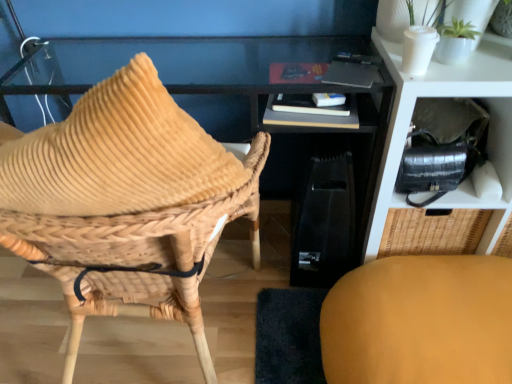
Question: Is matte yellow cushion at lower right, the first chair when ordered from right to left, closer to camera compared to matte black shelf at upper right?

Choices:
 (A) no
 (B) yes

Answer: (B)

Question: Is matte yellow cushion at lower right, positioned as the 2th chair in left-to-right order, taller than matte black shelf at upper right?

Choices:
 (A) yes
 (B) no

Answer: (B)

Question: Can you confirm if matte yellow cushion at lower right, the first chair when ordered from right to left, is smaller than matte black shelf at upper right?

Choices:
 (A) no
 (B) yes

Answer: (B)

Question: Is matte yellow cushion at lower right, the first chair when ordered from right to left, at the right side of matte black shelf at upper right?

Choices:
 (A) no
 (B) yes

Answer: (A)

Question: From the image's perspective, does matte yellow cushion at lower right, the first chair when ordered from right to left, appear higher than matte black shelf at upper right?

Choices:
 (A) no
 (B) yes

Answer: (A)

Question: From a real-world perspective, is matte yellow cushion at lower right, the first chair when ordered from right to left, beneath matte black shelf at upper right?

Choices:
 (A) yes
 (B) no

Answer: (A)

Question: Is hardcover book at center surrounding woven wood chair at left, which is the second chair from right to left?

Choices:
 (A) no
 (B) yes

Answer: (A)

Question: Considering the relative positions of hardcover book at center and woven wood chair at left, which is the second chair from right to left, in the image provided, is hardcover book at center to the right of woven wood chair at left, which is the second chair from right to left, from the viewer's perspective?

Choices:
 (A) no
 (B) yes

Answer: (B)

Question: From a real-world perspective, is hardcover book at center under woven wood chair at left, which is the second chair from right to left?

Choices:
 (A) no
 (B) yes

Answer: (A)

Question: Is hardcover book at center next to woven wood chair at left, arranged as the first chair when viewed from the left?

Choices:
 (A) yes
 (B) no

Answer: (B)

Question: Does hardcover book at center have a larger size compared to woven wood chair at left, arranged as the first chair when viewed from the left?

Choices:
 (A) yes
 (B) no

Answer: (B)

Question: From the image's perspective, is hardcover book at center located above woven wood chair at left, which is the second chair from right to left?

Choices:
 (A) yes
 (B) no

Answer: (A)

Question: Is hardcover book at center further to camera compared to matte yellow cushion at lower right, the first chair when ordered from right to left?

Choices:
 (A) yes
 (B) no

Answer: (A)